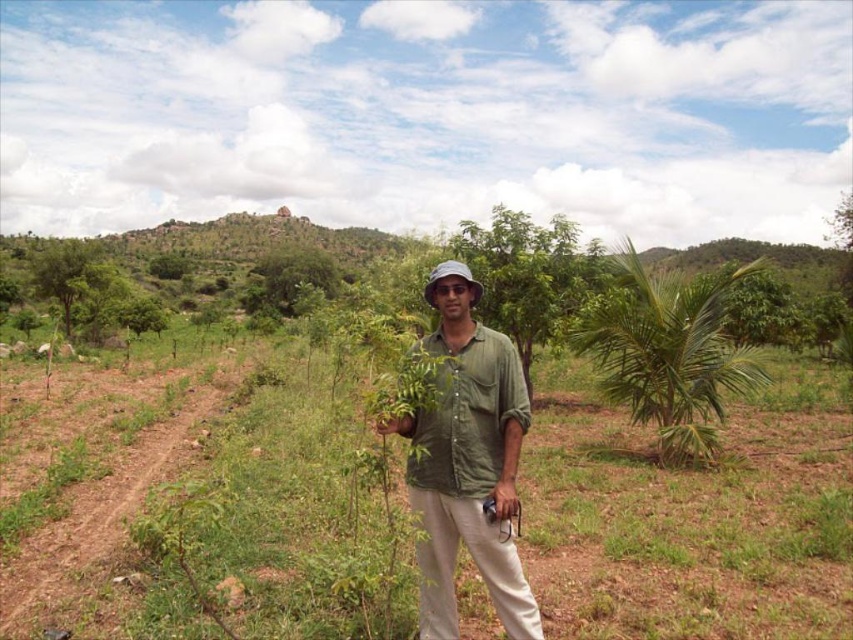
You are a photographer trying to capture the perfect shot of the green leafy tree at center and the green matte shirt at center. Based on their positions, which object is closer to the camera?

The green matte shirt at center is below the green leafy tree at center, meaning the shirt is closer to the camera.

You are a photographer trying to capture a photo of the green leafy palm at right while standing near the green matte shirt at center. Will the palm appear larger or smaller in the photo compared to its actual size in the scene?

The palm will appear smaller in the photo because the green leafy palm at right is larger in actual size than the green matte shirt at center, but since the photographer is positioned near the green matte shirt at center, the distance might affect the perception. However, based on the size comparison provided, the palm is actually bigger, so its appearance in the photo would depend on the camera angle and distance. The description only states the shirt is smaller in size compared to the palm, so without the